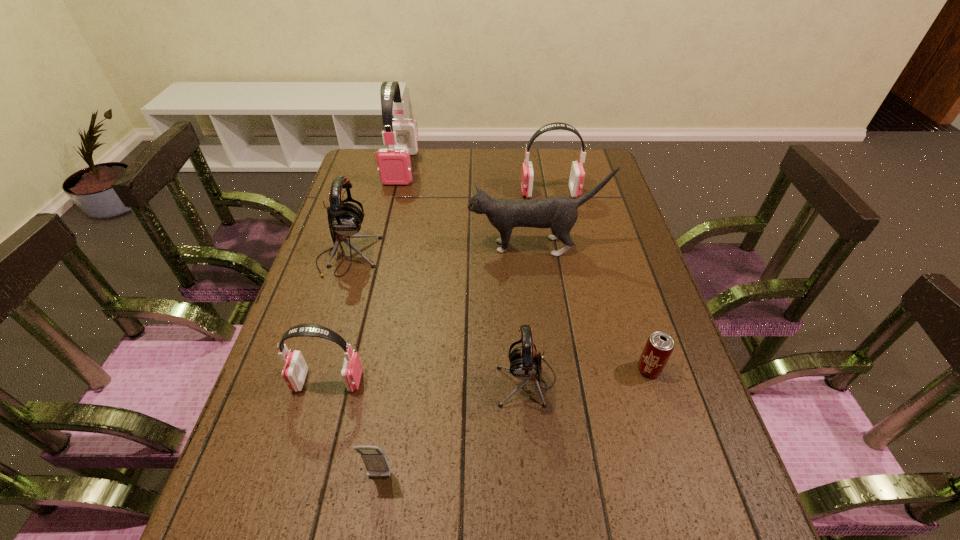
The width and height of the screenshot is (960, 540). I want to click on beer can, so click(659, 346).

Image resolution: width=960 pixels, height=540 pixels. In order to click on vacant space located on the outer surface of the tallest earphone in this screenshot , I will do `click(393, 202)`.

This screenshot has height=540, width=960. In order to click on free space located at the face of the cat in this screenshot , I will do `click(351, 247)`.

You are a GUI agent. You are given a task and a screenshot of the screen. Output one action in this format:
    pyautogui.click(x=<x>, y=<y>)
    Task: Click on the free space located 0.310m at the face of the cat
    This screenshot has height=540, width=960.
    Given the screenshot: What is the action you would take?
    pyautogui.click(x=362, y=247)

Locate an element on the screen. vacant space located at the face of the cat is located at coordinates (379, 247).

The width and height of the screenshot is (960, 540). Find the location of `free spot located on the back of the left black earphone`. free spot located on the back of the left black earphone is located at coordinates (376, 167).

At what (x,y) coordinates should I click in order to perform the action: click on vacant point located 0.360m on the outer surface of the rightmost pink earphone. Please return your answer as a coordinate pair (x, y). This screenshot has width=960, height=540. Looking at the image, I should click on (414, 192).

Locate an element on the screen. free space located on the outer surface of the rightmost pink earphone is located at coordinates (447, 192).

Find the location of `vacant region located 0.330m on the outer surface of the rightmost pink earphone`. vacant region located 0.330m on the outer surface of the rightmost pink earphone is located at coordinates (423, 192).

This screenshot has width=960, height=540. I want to click on vacant space located on the right of the smaller black earphone, so click(x=652, y=381).